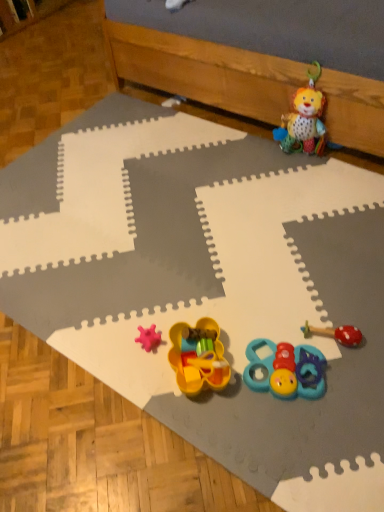
I want to click on free spot behind yellow plastic toy at center, acting as the 1th toy starting from the front, so click(205, 307).